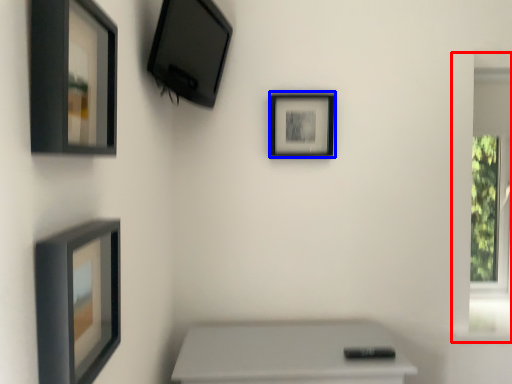
Question: Which object appears closest to the camera in this image, window frame (highlighted by a red box) or picture frame (highlighted by a blue box)?

Choices:
 (A) window frame
 (B) picture frame

Answer: (B)